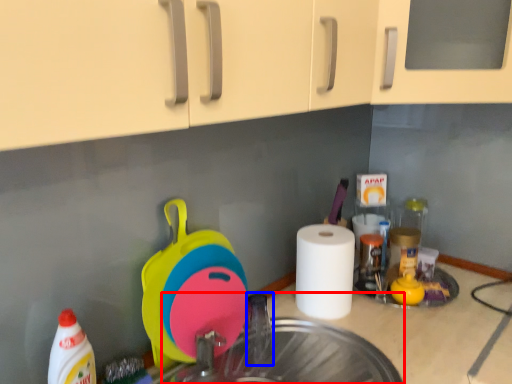
Question: Which point is further to the camera, sink (highlighted by a red box) or faucet (highlighted by a blue box)?

Choices:
 (A) sink
 (B) faucet

Answer: (B)